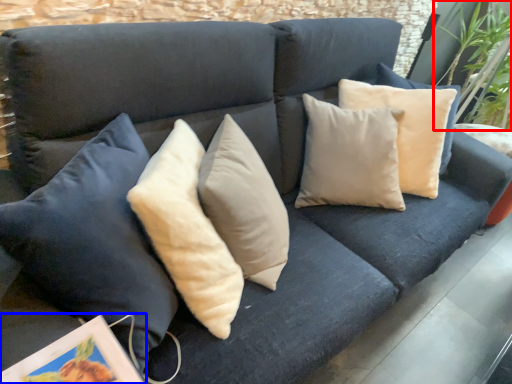
Question: Which object is further to the camera taking this photo, plant (highlighted by a red box) or picture frame (highlighted by a blue box)?

Choices:
 (A) plant
 (B) picture frame

Answer: (A)